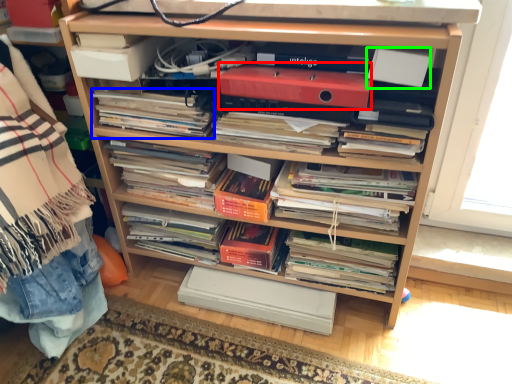
Question: Estimate the real-world distances between objects in this image. Which object is farther from paperback book (highlighted by a red box), magazine (highlighted by a blue box) or paperback book (highlighted by a green box)?

Choices:
 (A) magazine
 (B) paperback book

Answer: (A)